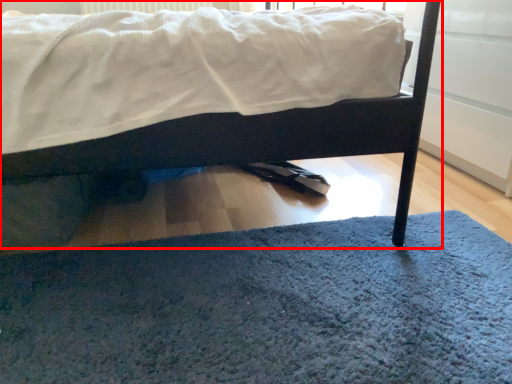
Question: Observing the image, what is the correct spatial positioning of bed (annotated by the red box) in reference to doormat?

Choices:
 (A) right
 (B) left

Answer: (B)